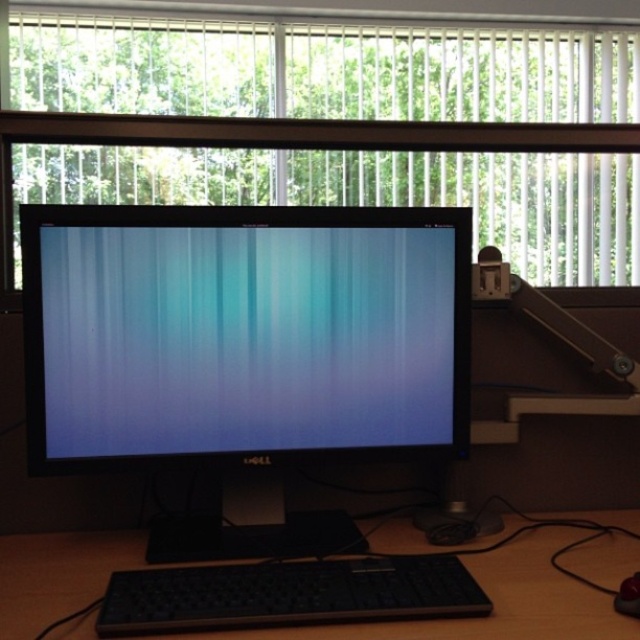
You are setting up a new webcam for video calls. The webcam has a recommended placement area of 0.5 meters in width and 0.3 meters in height. The center of this area should be at point 0.5 meters from the left edge and 0.3 meters from the top edge of the desk. Can the matte black monitor at center be placed within this recommended area?

The matte black monitor at center is located at point (243, 332). The recommended placement area has its center at 0.5 meters from the left and 0.3 meters from the top. The monitor is slightly to the right and lower than the recommended center. Since the area is 0.5m wide and 0.3m tall, the monitor is within the recommended placement area.

You are a technician trying to troubleshoot a cable issue. You notice a cable running from the Dell computer monitor to a point at coordinates point (164, 388). If the monitor is 1.03 meters away from this point, is the cable long enough to reach?

The distance between the Dell computer monitor and the point (164, 388) is 1.03 meters. Therefore, the cable must be at least 1.03 meters long to reach.

You are standing at the edge of the desk and want to reach two points on the desk surface. The first point is at coordinate point(420, 86) and the second is at point(620, 600). According to the image, which point is closer to you?

Point(420, 86) is behind point(620, 600), so the point closer to you is point(620, 600).